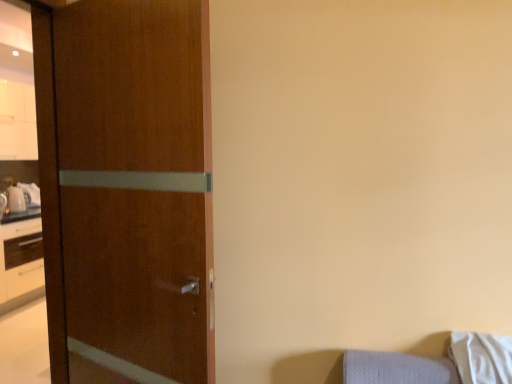
Question: Is white soft pillow at lower right positioned behind wooden door at left?

Choices:
 (A) no
 (B) yes

Answer: (B)

Question: Is white soft pillow at lower right smaller than wooden door at left?

Choices:
 (A) yes
 (B) no

Answer: (A)

Question: Does white soft pillow at lower right appear on the right side of wooden door at left?

Choices:
 (A) yes
 (B) no

Answer: (A)

Question: Can you confirm if white soft pillow at lower right is shorter than wooden door at left?

Choices:
 (A) no
 (B) yes

Answer: (B)

Question: Could you tell me if white soft pillow at lower right is facing wooden door at left?

Choices:
 (A) no
 (B) yes

Answer: (A)

Question: Is white soft pillow at lower right positioned far away from wooden door at left?

Choices:
 (A) yes
 (B) no

Answer: (A)

Question: Could you tell me if wooden door at left is facing white soft pillow at lower right?

Choices:
 (A) yes
 (B) no

Answer: (B)

Question: Is wooden door at left not near white soft pillow at lower right?

Choices:
 (A) yes
 (B) no

Answer: (A)

Question: Considering the relative sizes of wooden door at left and white soft pillow at lower right in the image provided, is wooden door at left thinner than white soft pillow at lower right?

Choices:
 (A) yes
 (B) no

Answer: (A)

Question: Considering the relative sizes of wooden door at left and white soft pillow at lower right in the image provided, is wooden door at left shorter than white soft pillow at lower right?

Choices:
 (A) no
 (B) yes

Answer: (A)

Question: Is the surface of wooden door at left in direct contact with white soft pillow at lower right?

Choices:
 (A) no
 (B) yes

Answer: (A)

Question: From the image's perspective, is wooden door at left above white soft pillow at lower right?

Choices:
 (A) yes
 (B) no

Answer: (A)

Question: From a real-world perspective, is white soft pillow at lower right physically located above or below wooden door at left?

Choices:
 (A) below
 (B) above

Answer: (A)